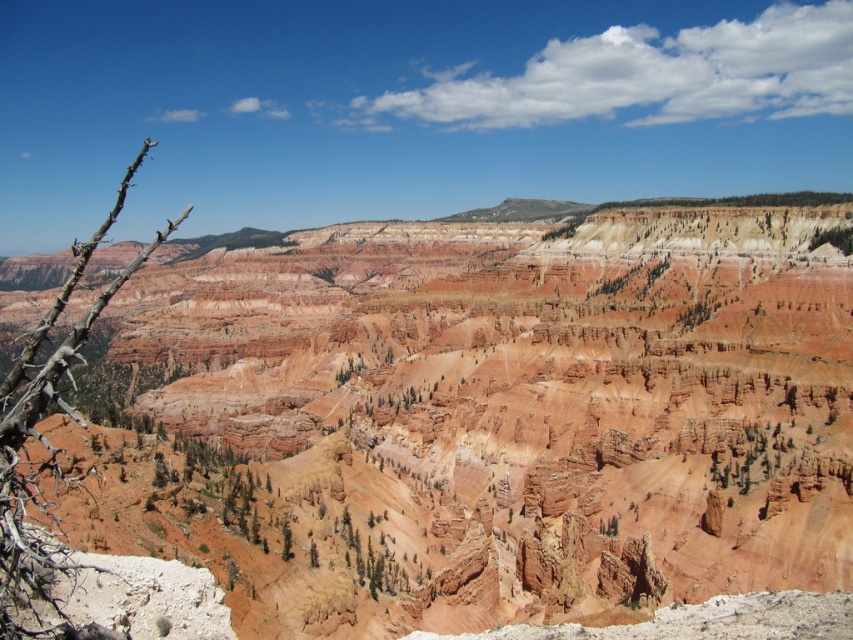
You are standing in the desert and see the rustic sandstone canyon at center and the green leafy tree at center. Which object is positioned to the left?

The rustic sandstone canyon at center is to the left of the green leafy tree at center, so the rustic sandstone canyon at center is positioned to the left.

You are a hiker trying to take a photo of the rustic sandstone canyon at center. However, the brown thorny branch at left is blocking your view. Can you move to the right to avoid the branch?

The brown thorny branch at left is behind the rustic sandstone canyon at center, so moving to the right might not help because the branch is already behind the canyon and not obstructing the view from that angle.